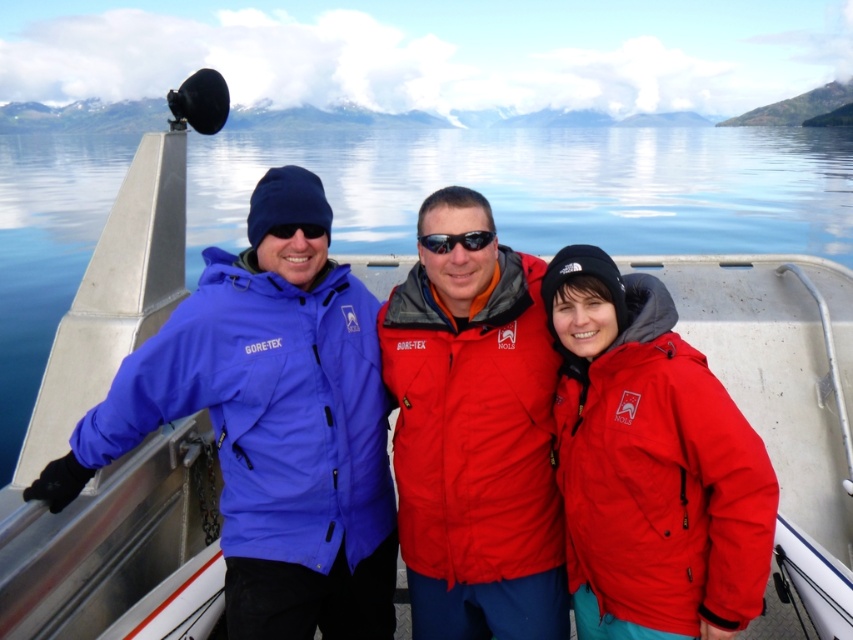
Is matte blue jacket at left positioned in front of red matte jacket at center?

No, it is not.

Can you confirm if matte blue jacket at left is positioned below red matte jacket at center?

Incorrect, matte blue jacket at left is not positioned below red matte jacket at center.

Does point (149, 372) come closer to viewer compared to point (561, 406)?

Yes, point (149, 372) is closer to viewer.

Find the location of a particular element. This screenshot has width=853, height=640. matte blue jacket at left is located at coordinates (271, 424).

Can you confirm if black reflective sunglasses at center is thinner than matte black goggles at center?

No, black reflective sunglasses at center is not thinner than matte black goggles at center.

Is point (428, 241) in front of point (311, 237)?

That is True.

Locate an element on the screen. The height and width of the screenshot is (640, 853). black reflective sunglasses at center is located at coordinates (456, 241).

Does matte blue jacket at left have a greater height compared to matte red jacket at center?

Yes.

Between matte blue jacket at left and matte red jacket at center, which one appears on the right side from the viewer's perspective?

matte red jacket at center is more to the right.

Between point (328, 422) and point (534, 278), which one is positioned in front?

Positioned in front is point (328, 422).

Where is `matte blue jacket at left`? Image resolution: width=853 pixels, height=640 pixels. matte blue jacket at left is located at coordinates (271, 424).